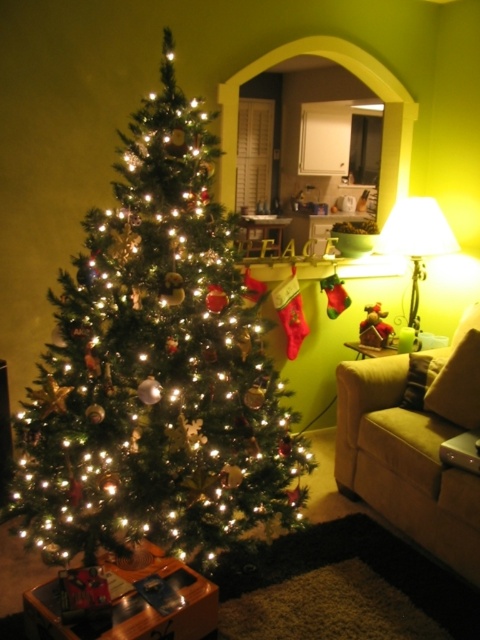
You are a delivery person who needs to place a package on the wooden table where the green matte christmas tree at left is located. The package is 7 feet long. Can you fit it on the table without moving the tree?

The distance between the green matte christmas tree at left and the beige sofa with dark green throw pillow on the right is 6.36 feet. Since the package is 7 feet long, it cannot be placed on the table without moving the tree because the available space is shorter than the package length.

You are planning to place a new rectangular shelf in the living room. The shelf is as wide as the white fabric lampshade at right. Can you place the shelf next to the green matte christmas tree at left without it being wider than the tree?

The green matte christmas tree at left is wider than the white fabric lampshade at right. Since the shelf is as wide as the white fabric lampshade at right, it will not exceed the tree width when placed next to it.